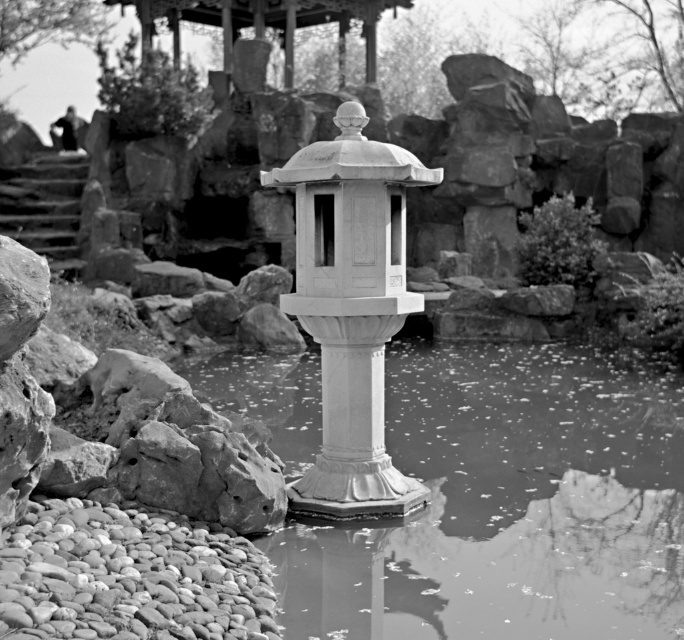
Question: Which object is positioned closest to the smooth wooden gazebo at upper center?

Choices:
 (A) translucent glass water at center
 (B) white stone lantern at center

Answer: (A)

Question: Which object appears farthest from the camera in this image?

Choices:
 (A) smooth wooden gazebo at upper center
 (B) translucent glass water at center
 (C) white stone lantern at center

Answer: (A)

Question: Is white stone lantern at center in front of smooth wooden gazebo at upper center?

Choices:
 (A) no
 (B) yes

Answer: (B)

Question: Estimate the real-world distances between objects in this image. Which object is closer to the translucent glass water at center?

Choices:
 (A) white stone lantern at center
 (B) smooth wooden gazebo at upper center

Answer: (A)

Question: Is translucent glass water at center to the left of smooth wooden gazebo at upper center from the viewer's perspective?

Choices:
 (A) no
 (B) yes

Answer: (A)

Question: Does translucent glass water at center have a lesser width compared to smooth wooden gazebo at upper center?

Choices:
 (A) no
 (B) yes

Answer: (B)